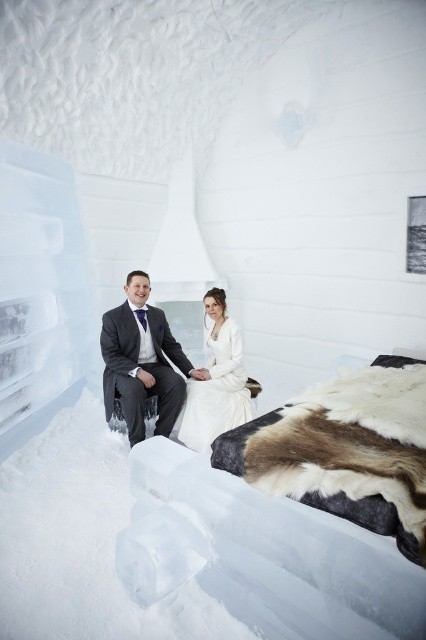
Question: Which object appears farthest from the camera in this image?

Choices:
 (A) white satin dress at center
 (B) matte gray suit at left

Answer: (A)

Question: Does matte gray suit at left have a greater width compared to white satin dress at center?

Choices:
 (A) no
 (B) yes

Answer: (B)

Question: Is matte gray suit at left smaller than white satin dress at center?

Choices:
 (A) no
 (B) yes

Answer: (A)

Question: Which of the following is the farthest from the observer?

Choices:
 (A) click(181, 435)
 (B) click(175, 406)

Answer: (B)

Question: Where is matte gray suit at left located in relation to white satin dress at center in the image?

Choices:
 (A) left
 (B) right

Answer: (A)